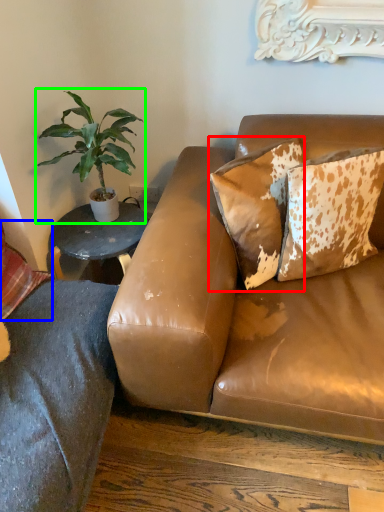
Question: Based on their relative distances, which object is nearer to pillow (highlighted by a red box)? Choose from pillow (highlighted by a blue box) and houseplant (highlighted by a green box).

Choices:
 (A) pillow
 (B) houseplant

Answer: (B)